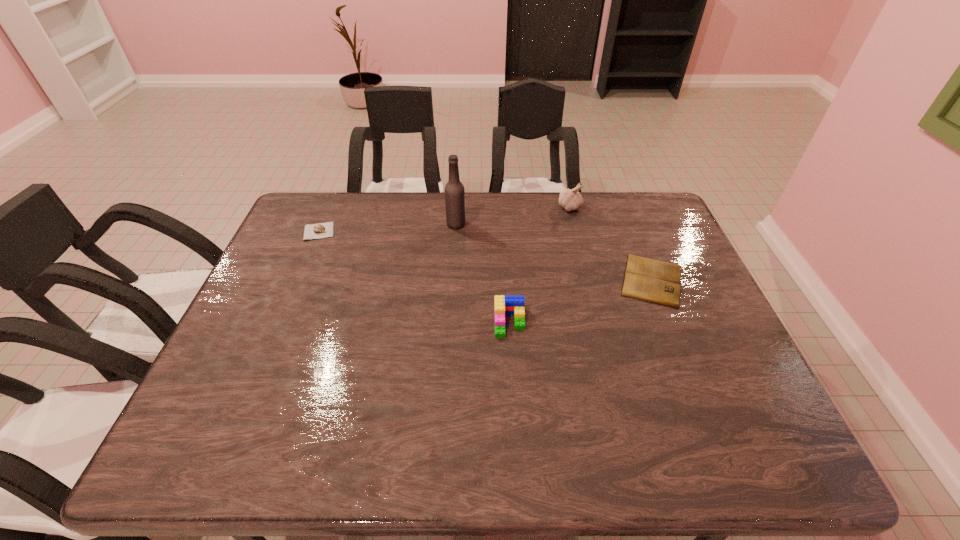
Where is `the fourth object from right to left`? The height and width of the screenshot is (540, 960). the fourth object from right to left is located at coordinates (454, 190).

The height and width of the screenshot is (540, 960). I want to click on beer bottle, so click(x=454, y=190).

Image resolution: width=960 pixels, height=540 pixels. What are the coordinates of `the farthest object` in the screenshot? It's located at (569, 199).

This screenshot has width=960, height=540. I want to click on the second tallest object, so click(x=569, y=199).

Identify the location of the third object from left to right. (503, 305).

Find the location of `the third tallest object`. the third tallest object is located at coordinates (503, 305).

Where is `the nearer garlic`? The width and height of the screenshot is (960, 540). the nearer garlic is located at coordinates (319, 230).

Where is `the shorter garlic`? The image size is (960, 540). the shorter garlic is located at coordinates (319, 230).

I want to click on the shortest object, so click(654, 281).

This screenshot has height=540, width=960. In order to click on book in this screenshot , I will do `click(654, 281)`.